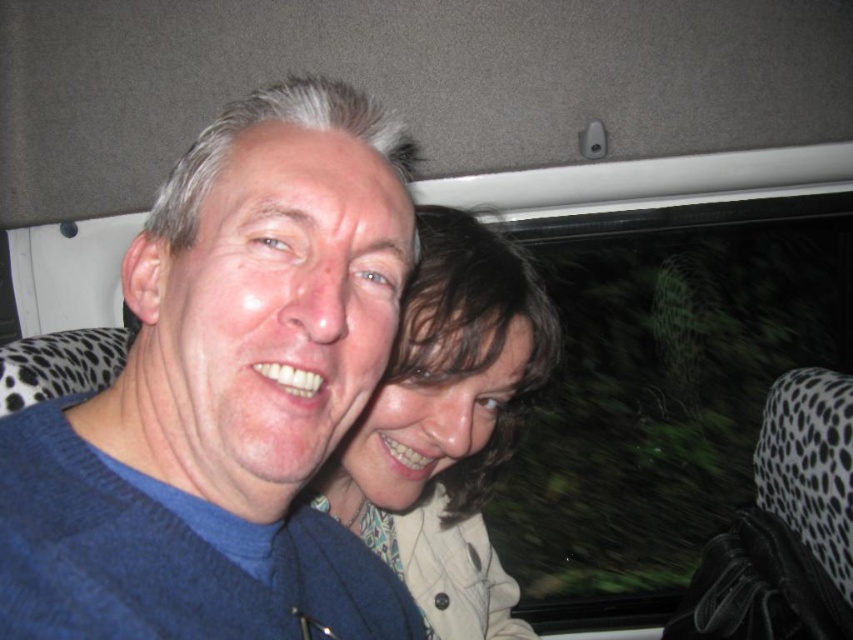
You are a photographer trying to focus on two points in the image of the two people in the vehicle. The first point is at coordinates point (419, 435) and the second is at point (772, 602). Which point should you adjust your focus to first if you want to capture the closest object to the camera?

Point (419, 435) is closer to the camera than point (772, 602), so you should adjust your focus to point (419, 435) first to capture the closest object.

In the scene shown: You are designing a new seat cover for the vehicle shown. The blue knitted sweater at center and the black dotted fabric at right are two existing seat covers. Which seat cover is narrower?

The blue knitted sweater at center is narrower than the black dotted fabric at right.

You are a photographer trying to capture a candid shot of both the blue knitted sweater at center and the light brown textured hair at center in the scene. Since you want to ensure both subjects are fully visible, which one should you position your camera to focus on first to avoid blocking?

You should focus on the blue knitted sweater at center first because it is positioned to the left of the light brown textured hair at center, so capturing it first ensures that the light brown textured hair at center isn